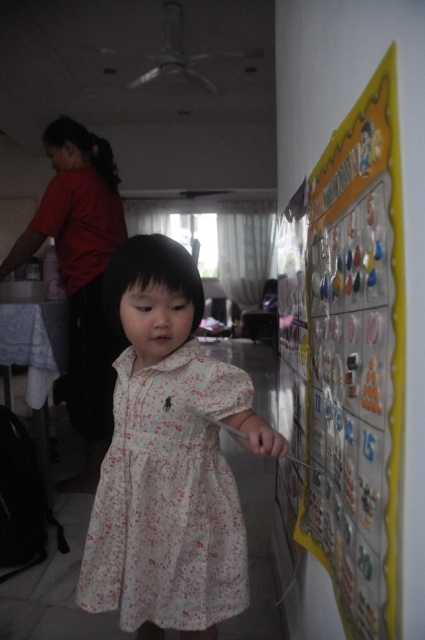
You are a teacher observing a classroom scene. You notice the yellow paperboard at right and the white floral dress at center. Which object is located to the right of the other?

The yellow paperboard at right is positioned on the right side of white floral dress at center.

You are a parent trying to ensure your child stays within a safe distance from the wall. The recommended safe distance is 12 inches. Based on the scene, can the child wearing the white floral dress at center safely interact with the yellow paperboard at right without being too close?

The distance between the yellow paperboard at right and the white floral dress at center is 11.43 inches, which is less than the recommended 12 inches. Therefore, the child wearing the white floral dress at center is too close to the yellow paperboard at right.